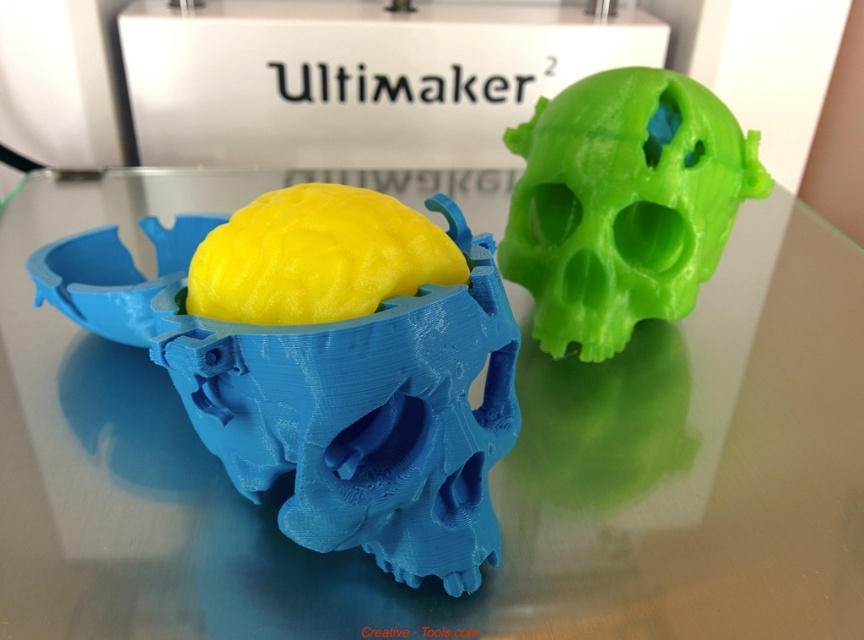
You are an event attendee at the exhibition and want to take a photo of both the transparent glass skull at center and the green matte skull at upper right. Which one should you focus on first if you want to capture both in the same frame?

You should focus on the transparent glass skull at center first because it is positioned on the left side of the green matte skull at upper right, so capturing it first ensures both are in the frame.

You are an event organizer at the exhibition. You need to determine if the transparent glass skull at center can fit into a storage box designed for the green matte skull at upper right. Based on their sizes, will it fit?

The transparent glass skull at center is wider than the green matte skull at upper right, so it will not fit into the storage box designed for the green matte skull at upper right.

You are an event attendee at the Ultimaker exhibition. You notice two skulls displayed on the table. The transparent glass skull at center and the green matte skull at upper right. Which one is taller?

The transparent glass skull at center is taller than the green matte skull at upper right.